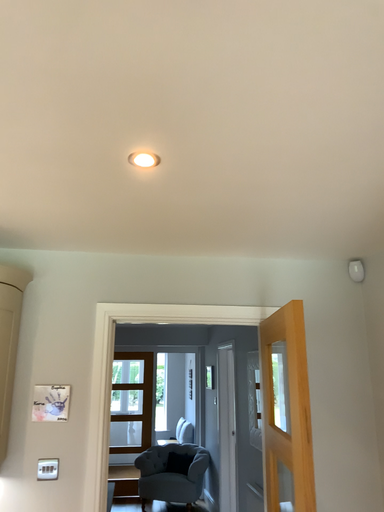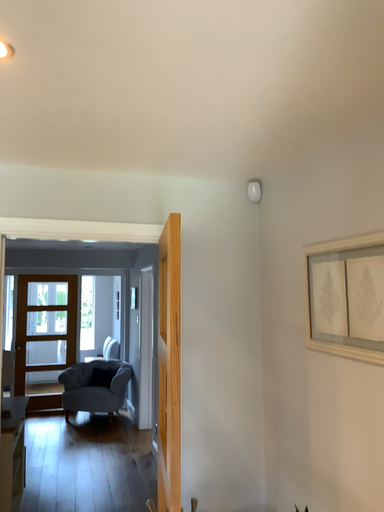
Question: Which way did the camera rotate in the video?

Choices:
 (A) rotated right
 (B) rotated left

Answer: (A)